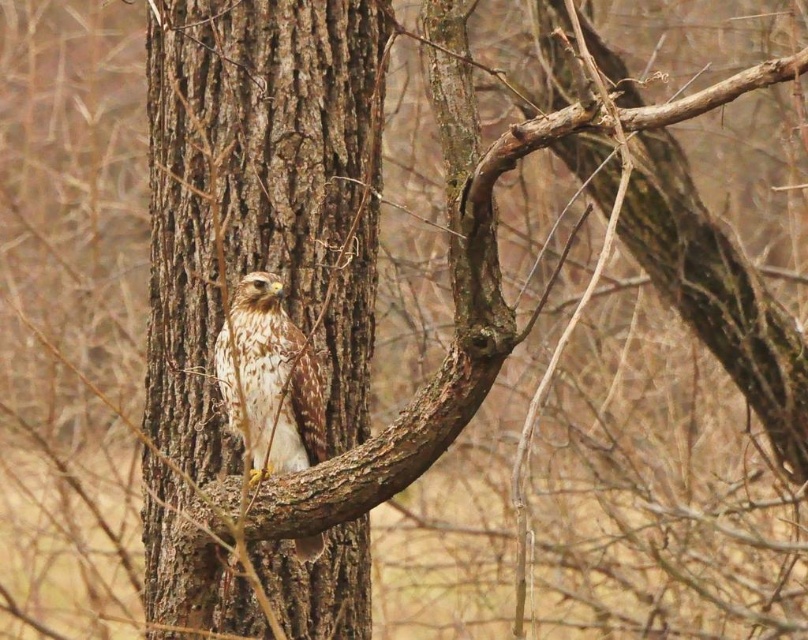
Question: Which point is farther to the camera?

Choices:
 (A) (285, 406)
 (B) (356, 122)

Answer: (B)

Question: Which of the following is the farthest from the observer?

Choices:
 (A) (306, 284)
 (B) (268, 365)

Answer: (A)

Question: Does brown rough bark tree trunk at center appear on the right side of brown speckled feathers at center?

Choices:
 (A) no
 (B) yes

Answer: (A)

Question: Is brown rough bark tree trunk at center to the right of brown speckled feathers at center from the viewer's perspective?

Choices:
 (A) yes
 (B) no

Answer: (B)

Question: Which object appears closest to the camera in this image?

Choices:
 (A) brown rough bark tree trunk at center
 (B) brown speckled feathers at center

Answer: (B)

Question: Is brown rough bark tree trunk at center above brown speckled feathers at center?

Choices:
 (A) no
 (B) yes

Answer: (B)